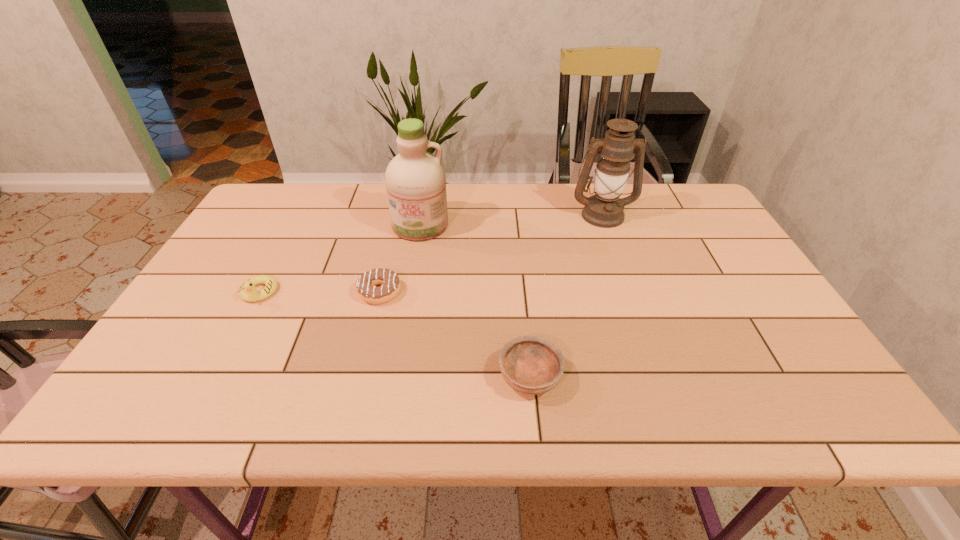
Locate an element on the screen. This screenshot has height=540, width=960. cleansing agent is located at coordinates (415, 180).

This screenshot has width=960, height=540. I want to click on oil lamp, so click(604, 209).

This screenshot has width=960, height=540. I want to click on duckling, so click(x=247, y=291).

Locate an element on the screen. The height and width of the screenshot is (540, 960). the nearest object is located at coordinates (533, 365).

What are the coordinates of `the fourth object from left to right` in the screenshot? It's located at (533, 365).

Identify the location of the shortest object. (366, 287).

Locate an element on the screen. The image size is (960, 540). free space located 0.140m on the front label of the cleansing agent is located at coordinates (412, 274).

Locate an element on the screen. vacant space situated 0.230m on the left of the rightmost object is located at coordinates (497, 214).

I want to click on vacant region located on the face of the leftmost object, so click(x=211, y=381).

Locate an element on the screen. This screenshot has width=960, height=540. vacant space located 0.180m on the right of the nearest object is located at coordinates (646, 376).